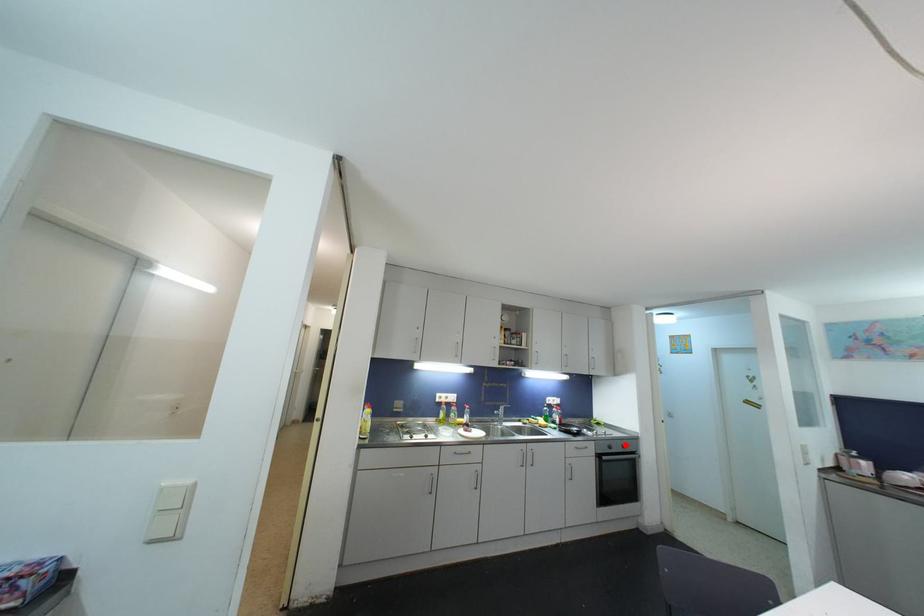
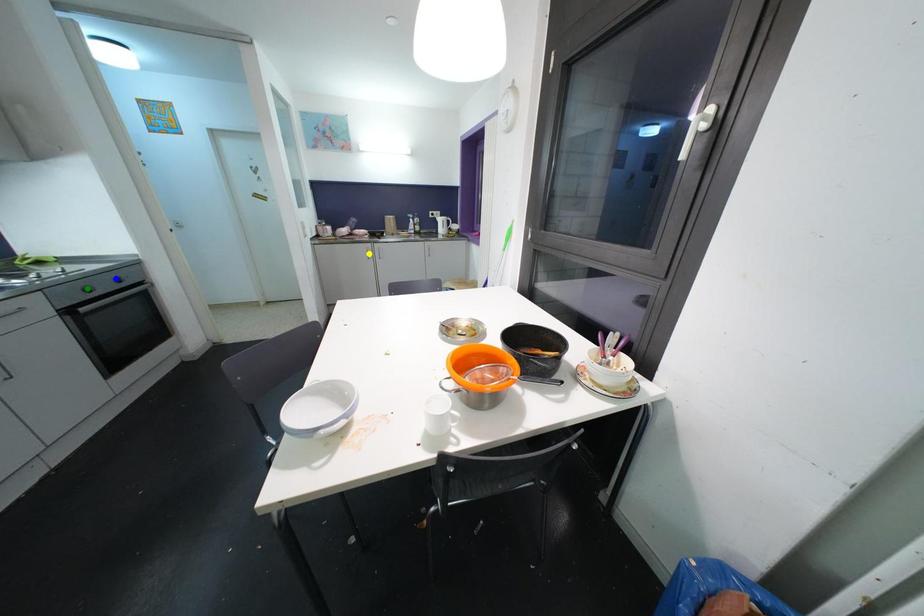
Question: I am providing you with two images of the same scene from different viewpoints. A red point is marked on the first image. You are given multiple points on the second image. Which point in image 2 represents the same 3d spot as the red point in image 1?

Choices:
 (A) green point
 (B) blue point
 (C) yellow point

Answer: (B)